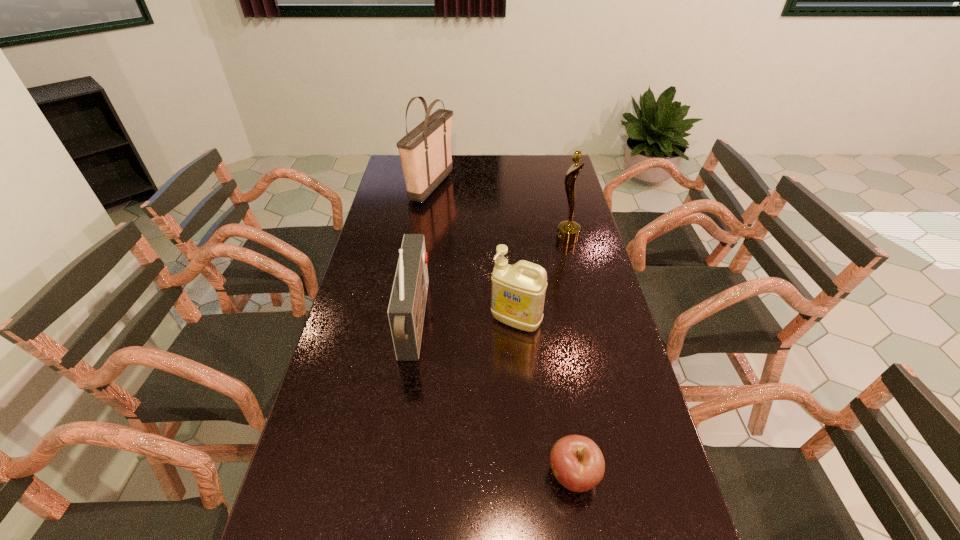
Locate an element on the screen. The image size is (960, 540). object that is the fourth closest to the rightmost object is located at coordinates (577, 462).

Select which object appears as the closest to the award. Please provide its 2D coordinates. Your answer should be formatted as a tuple, i.e. [(x, y)], where the tuple contains the x and y coordinates of a point satisfying the conditions above.

[(518, 291)]

Find the location of a particular element. This screenshot has height=540, width=960. vacant area in the image that satisfies the following two spatial constraints: 1. on the front-facing side of the award; 2. on the front side of the detergent is located at coordinates (588, 321).

This screenshot has height=540, width=960. I want to click on blank area in the image that satisfies the following two spatial constraints: 1. on the front-facing side of the rightmost object; 2. on the front side of the detergent, so click(x=588, y=321).